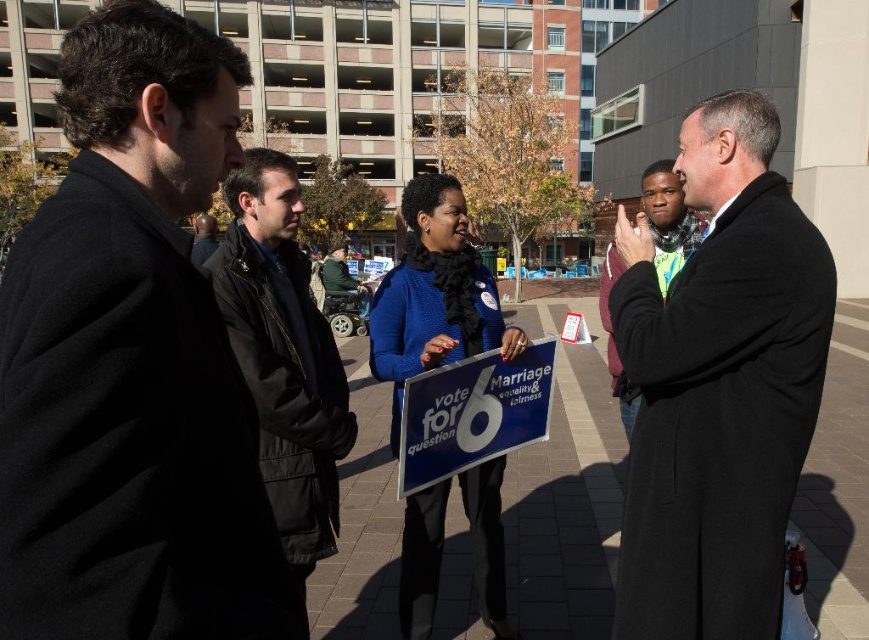
Which is above, dark wool coat at left or blue plastic sign at center?

dark wool coat at left is higher up.

From the picture: Is dark wool coat at left in front of blue plastic sign at center?

Yes, dark wool coat at left is closer to the viewer.

Between point (75, 513) and point (528, 344), which one is positioned in front?

Point (75, 513)

Where is `dark wool coat at left`? dark wool coat at left is located at coordinates tap(131, 364).

Consider the image. Can you confirm if dark wool coat at left is shorter than black puffy jacket at center?

Yes, dark wool coat at left is shorter than black puffy jacket at center.

Does dark wool coat at left appear on the left side of black puffy jacket at center?

Incorrect, dark wool coat at left is not on the left side of black puffy jacket at center.

Who is more forward, [5,371] or [297,568]?

Point [5,371] is more forward.

This screenshot has width=869, height=640. I want to click on dark wool coat at left, so (x=131, y=364).

What are the coordinates of `black puffy jacket at center` in the screenshot? It's located at (283, 356).